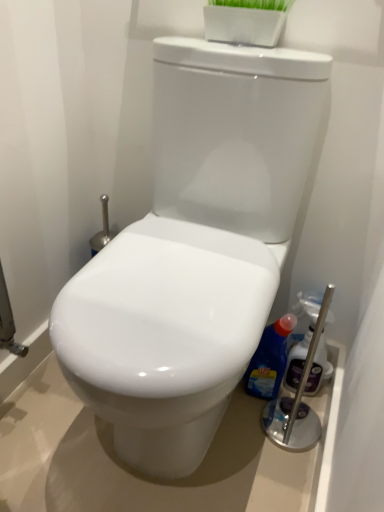
Find the location of a particular element. The height and width of the screenshot is (512, 384). free location in front of translucent plastic spray bottle at right, which is counted as the first cleaning product, starting from the right is located at coordinates (288, 435).